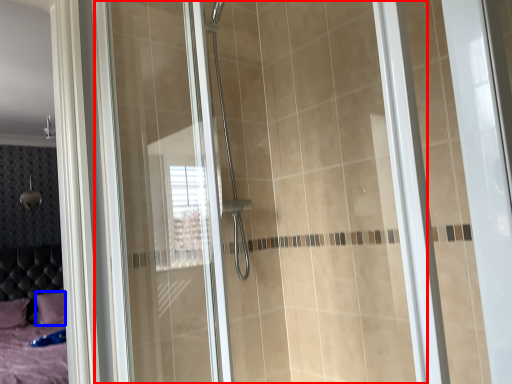
Question: Which object appears closest to the camera in this image, glass door (highlighted by a red box) or pillow (highlighted by a blue box)?

Choices:
 (A) glass door
 (B) pillow

Answer: (A)